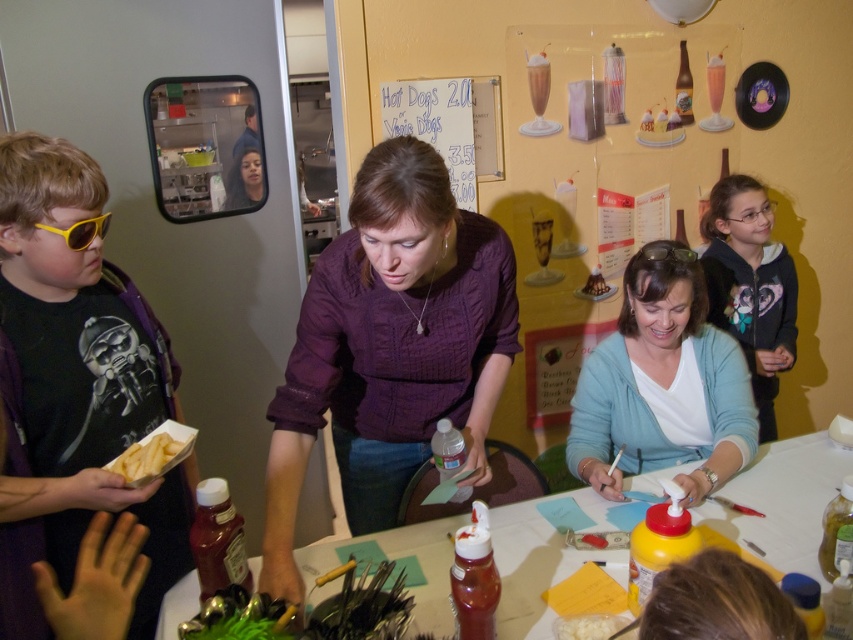
Does matte black shirt at left appear under black plastic goggles at center?

Yes, matte black shirt at left is below black plastic goggles at center.

Who is more distant from viewer, (x=102, y=396) or (x=682, y=252)?

The point (x=682, y=252) is more distant.

Which is behind, point (120, 444) or point (688, 257)?

The point (688, 257) is more distant.

The height and width of the screenshot is (640, 853). Find the location of `matte black shirt at left`. matte black shirt at left is located at coordinates (74, 388).

Can you confirm if white matte shirt at center is taller than yellow matte french fries at lower left?

Yes.

Can you confirm if white matte shirt at center is positioned below yellow matte french fries at lower left?

No.

Is point (717, 390) positioned after point (149, 449)?

Yes, point (717, 390) is farther from viewer.

What are the coordinates of `white matte shirt at center` in the screenshot? It's located at (662, 388).

Between white paperboard at upper center and chocolate cake at center, which one appears on the right side from the viewer's perspective?

Positioned to the right is chocolate cake at center.

Who is higher up, white paperboard at upper center or chocolate cake at center?

white paperboard at upper center is above.

Which is in front, point (396, 92) or point (585, 289)?

Point (396, 92)

Identify the location of white paperboard at upper center. Image resolution: width=853 pixels, height=640 pixels. (450, 125).